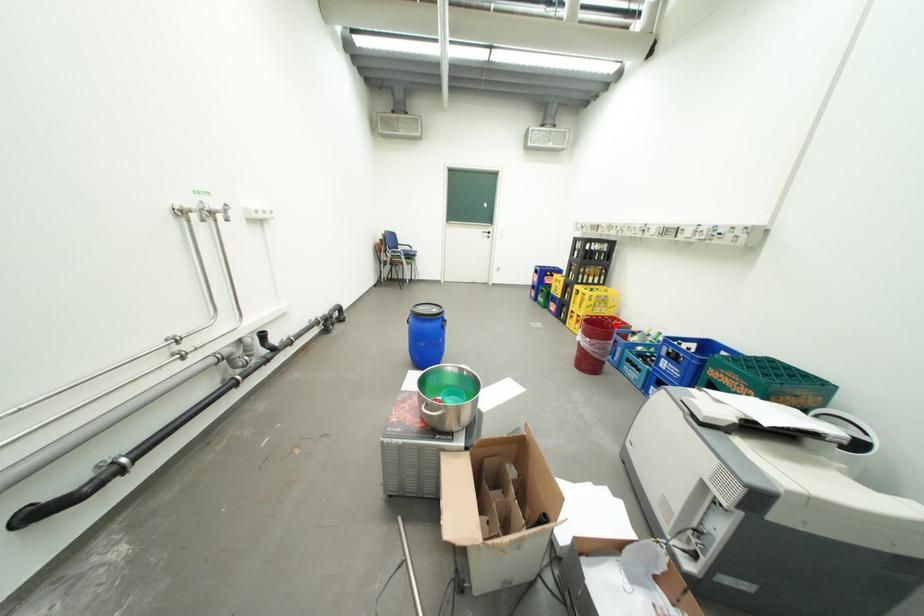
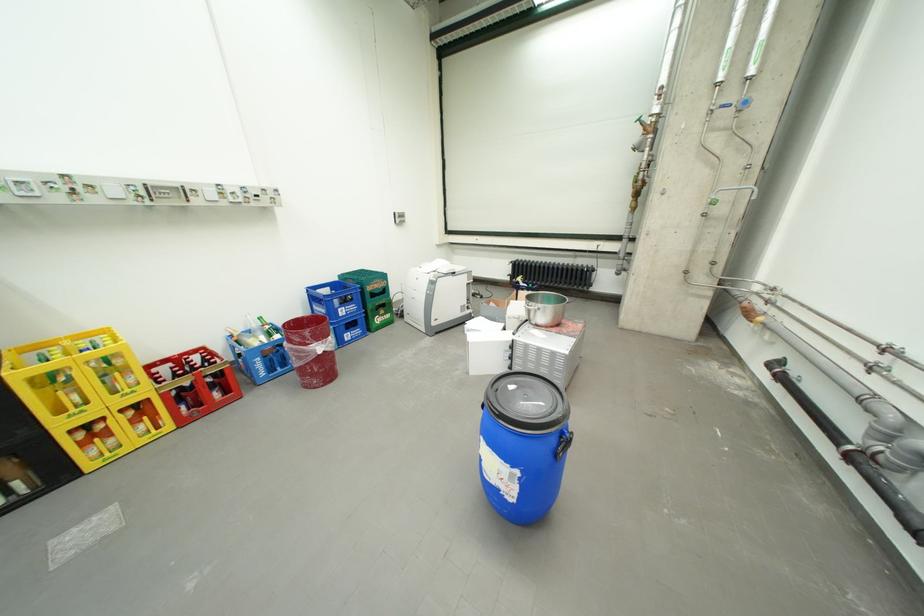
Question: I am providing you with two images of the same scene from different viewpoints. In image1, a red point is highlighted. Considering the same 3D point in image2, which of the following is correct?

Choices:
 (A) It is closer
 (B) It is farther

Answer: (B)